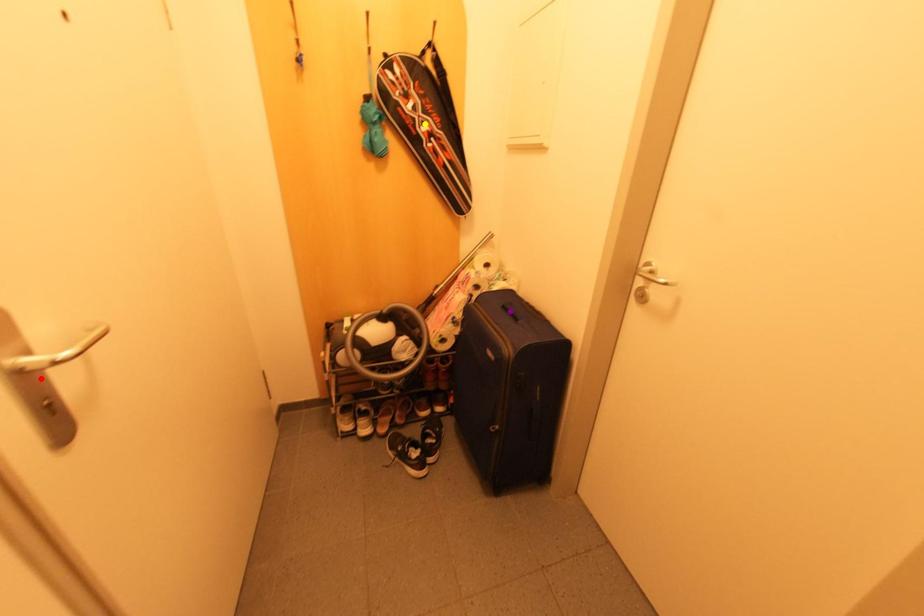
Order these from nearest to farthest:
yellow point
purple point
red point

red point
purple point
yellow point